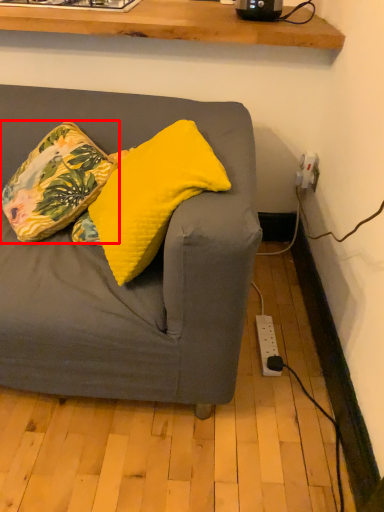
Question: In this image, where is pillow (annotated by the red box) located relative to pillow?

Choices:
 (A) left
 (B) right

Answer: (A)